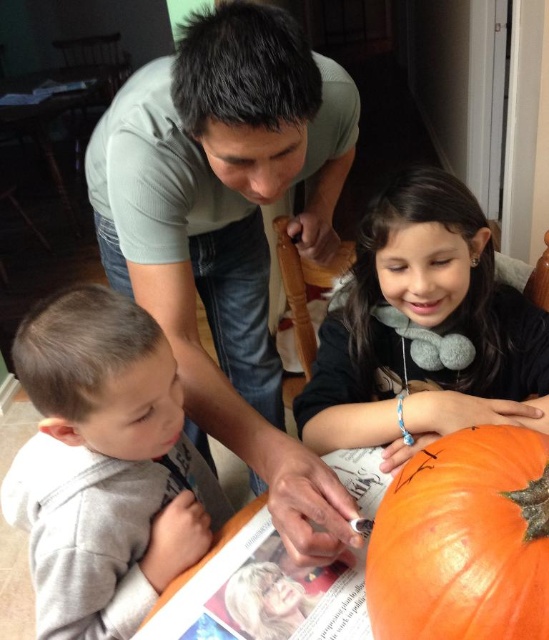
Between point (94, 292) and point (362, 376), which one is positioned in front?

Point (94, 292) is more forward.

Does gray fleece shirt at lower left come in front of matte orange pumpkin at center?

Yes, gray fleece shirt at lower left is closer to the viewer.

Does point (130, 300) come farther from viewer compared to point (485, 252)?

No, it is in front of (485, 252).

The image size is (549, 640). Identify the location of gray fleece shirt at lower left. (100, 461).

Between orange pumpkin at lower center and gray fleece shirt at lower left, which one has less height?

Standing shorter between the two is orange pumpkin at lower center.

Does orange pumpkin at lower center appear over gray fleece shirt at lower left?

Indeed, orange pumpkin at lower center is positioned over gray fleece shirt at lower left.

Is point (425, 557) farther from camera compared to point (164, 440)?

No.

Where is `orange pumpkin at lower center`? orange pumpkin at lower center is located at coordinates (396, 556).

Does matte green shirt at upper center lie behind matte orange pumpkin at center?

That is False.

Which is behind, point (277, 67) or point (327, 412)?

The point (327, 412) is behind.

The image size is (549, 640). I want to click on matte green shirt at upper center, so [228, 230].